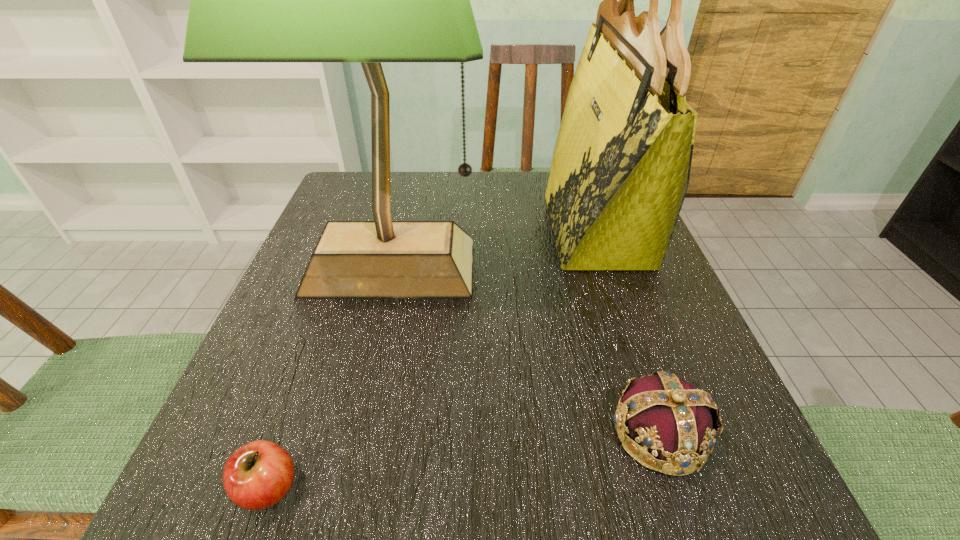
I want to click on object present at the far edge, so click(620, 171).

Identify the location of crown present at the near edge. The height and width of the screenshot is (540, 960). (678, 423).

This screenshot has height=540, width=960. In order to click on apple positioned at the near edge in this screenshot , I will do `click(258, 475)`.

This screenshot has width=960, height=540. I want to click on table lamp that is at the left edge, so click(x=370, y=0).

At what (x,y) coordinates should I click in order to perform the action: click on apple that is positioned at the left edge. Please return your answer as a coordinate pair (x, y). Looking at the image, I should click on (258, 475).

Identify the location of tote bag present at the right edge. (620, 171).

Where is `crown that is at the right edge`? crown that is at the right edge is located at coordinates (678, 423).

Find the location of a particular element. This screenshot has width=960, height=540. object present at the near left corner is located at coordinates (258, 475).

You are a GUI agent. You are given a task and a screenshot of the screen. Output one action in this format:
    pyautogui.click(x=<x>, y=<y>)
    Task: Click on the object that is positioned at the far right corner
    This screenshot has height=540, width=960.
    Given the screenshot: What is the action you would take?
    pyautogui.click(x=620, y=171)

The height and width of the screenshot is (540, 960). I want to click on object that is at the near right corner, so click(678, 423).